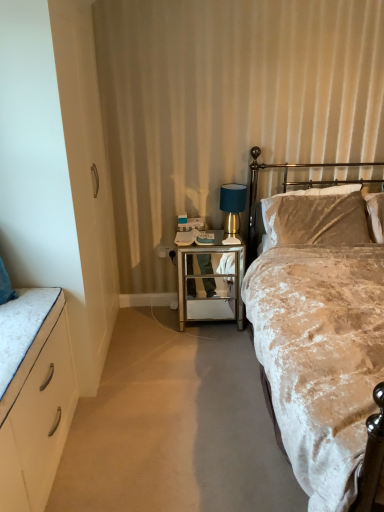
Question: Can you confirm if velvet beige bed at right is smaller than black plastic power outlet at center?

Choices:
 (A) yes
 (B) no

Answer: (B)

Question: Is velvet beige bed at right oriented towards black plastic power outlet at center?

Choices:
 (A) no
 (B) yes

Answer: (A)

Question: Is velvet beige bed at right placed right next to black plastic power outlet at center?

Choices:
 (A) no
 (B) yes

Answer: (A)

Question: Is velvet beige bed at right thinner than black plastic power outlet at center?

Choices:
 (A) no
 (B) yes

Answer: (A)

Question: Is velvet beige bed at right wider than black plastic power outlet at center?

Choices:
 (A) no
 (B) yes

Answer: (B)

Question: Is velvet beige bed at right not within black plastic power outlet at center?

Choices:
 (A) yes
 (B) no

Answer: (A)

Question: Considering the relative sizes of velvet beige bed at right and gold metallic headboard at upper right in the image provided, is velvet beige bed at right shorter than gold metallic headboard at upper right?

Choices:
 (A) yes
 (B) no

Answer: (B)

Question: Does velvet beige bed at right have a lesser width compared to gold metallic headboard at upper right?

Choices:
 (A) yes
 (B) no

Answer: (B)

Question: Are velvet beige bed at right and gold metallic headboard at upper right far apart?

Choices:
 (A) no
 (B) yes

Answer: (A)

Question: Does velvet beige bed at right turn towards gold metallic headboard at upper right?

Choices:
 (A) yes
 (B) no

Answer: (B)

Question: From the image's perspective, does velvet beige bed at right appear lower than gold metallic headboard at upper right?

Choices:
 (A) no
 (B) yes

Answer: (B)

Question: Is velvet beige bed at right placed right next to gold metallic headboard at upper right?

Choices:
 (A) yes
 (B) no

Answer: (B)

Question: Is black plastic power outlet at center closer to camera compared to mirrored glass side table at center?

Choices:
 (A) no
 (B) yes

Answer: (A)